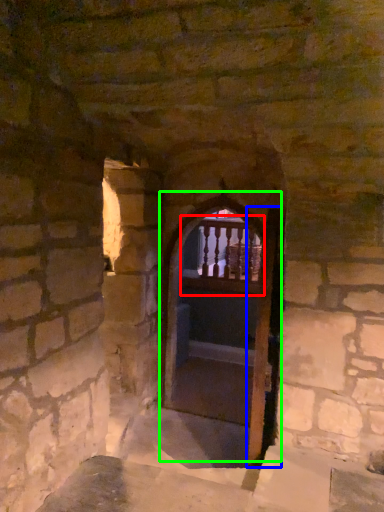
Question: Which object is positioned farthest from balcony (highlighted by a red box)? Select from screen door (highlighted by a blue box) and door (highlighted by a green box).

Choices:
 (A) screen door
 (B) door

Answer: (A)